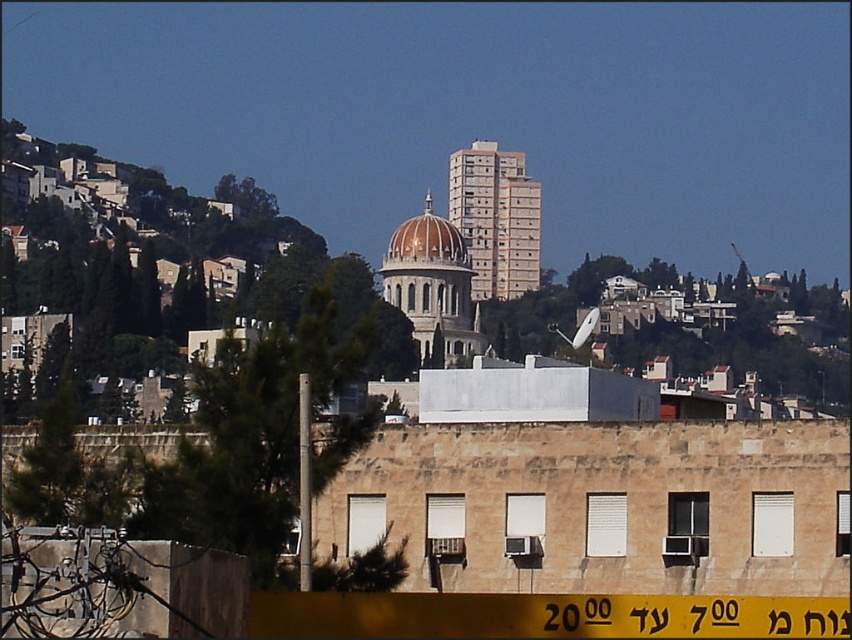
You are an architect analyzing the cityscape. Based on the image, which structure is taller between the beige concrete tower at center and the golden dome building at center?

The beige concrete tower at center is taller than the golden dome building at center.

You are a tourist standing in front of the beige concrete tower at center and the golden dome building at center. Which building is closer to you?

The beige concrete tower at center is closer to you because the golden dome building at center is behind it.

You are a city planner analyzing the cityscape. You need to determine which structure occupies more horizontal space in the image. Based on the beige concrete tower at center and the golden glass dome at center, which one has a greater width?

The beige concrete tower at center has a greater width than the golden glass dome at center according to the description provided.